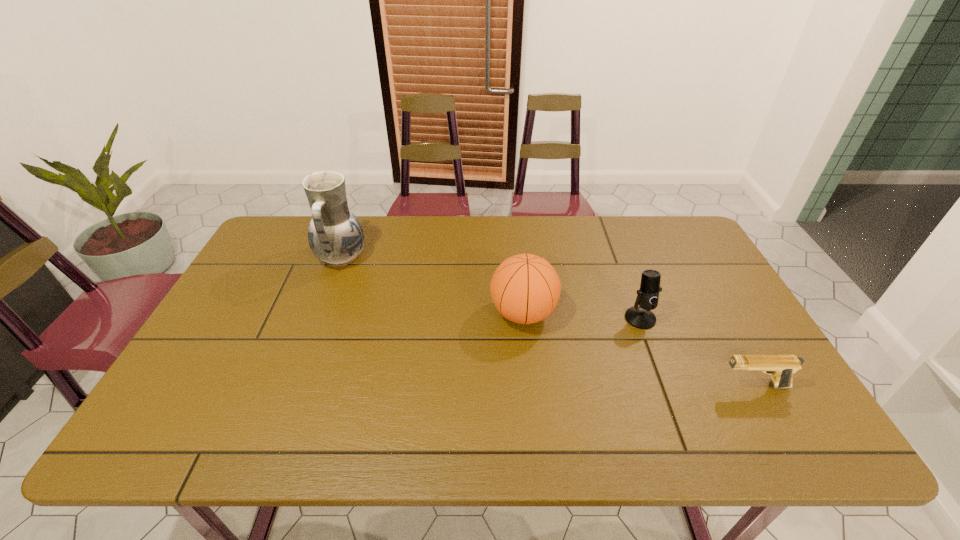
Identify the location of the tallest object. (335, 235).

Find the location of a particular element. The height and width of the screenshot is (540, 960). the leftmost object is located at coordinates (335, 235).

Image resolution: width=960 pixels, height=540 pixels. What are the coordinates of `basketball` in the screenshot? It's located at (525, 288).

Where is `the third object from right to left`? This screenshot has height=540, width=960. the third object from right to left is located at coordinates (525, 288).

Where is `microphone`? The height and width of the screenshot is (540, 960). microphone is located at coordinates (640, 317).

The image size is (960, 540). Identify the location of the second shortest object. (640, 317).

The image size is (960, 540). I want to click on the shortest object, so click(x=781, y=368).

This screenshot has height=540, width=960. Identify the location of pistol. (781, 368).

At what (x,y) coordinates should I click in order to perform the action: click on blank space located 0.360m on the front-facing side of the leftmost object. Please return your answer as a coordinate pair (x, y). Looking at the image, I should click on (480, 258).

This screenshot has width=960, height=540. What are the coordinates of `free space located 0.380m on the back of the basketball` in the screenshot? It's located at point(514,219).